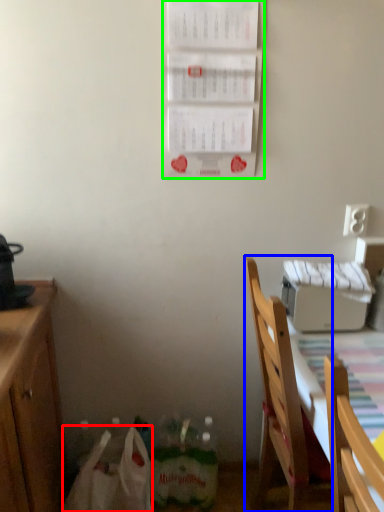
Question: Which is nearer to the paper bag (highlighted by a red box)? chair (highlighted by a blue box) or bulletin board (highlighted by a green box).

Choices:
 (A) chair
 (B) bulletin board

Answer: (A)